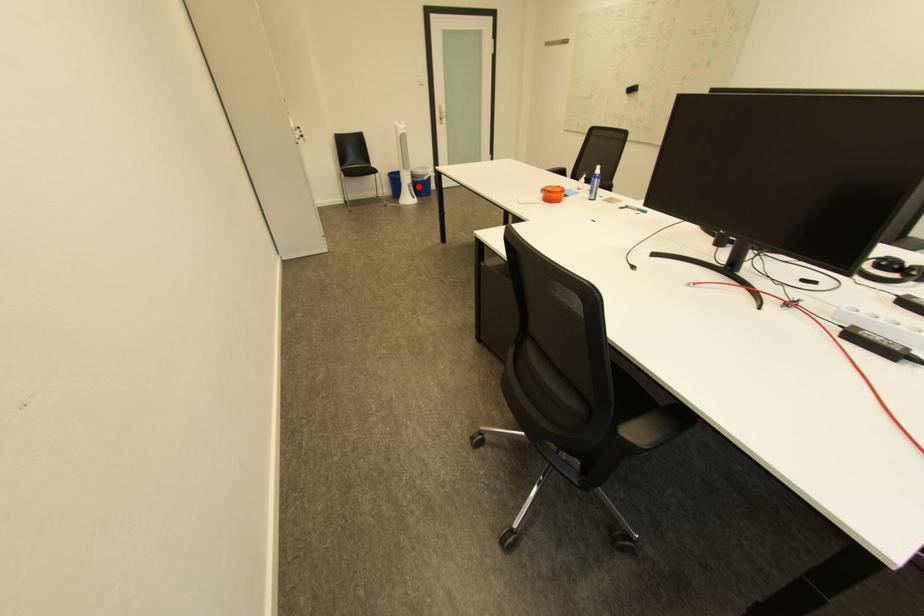
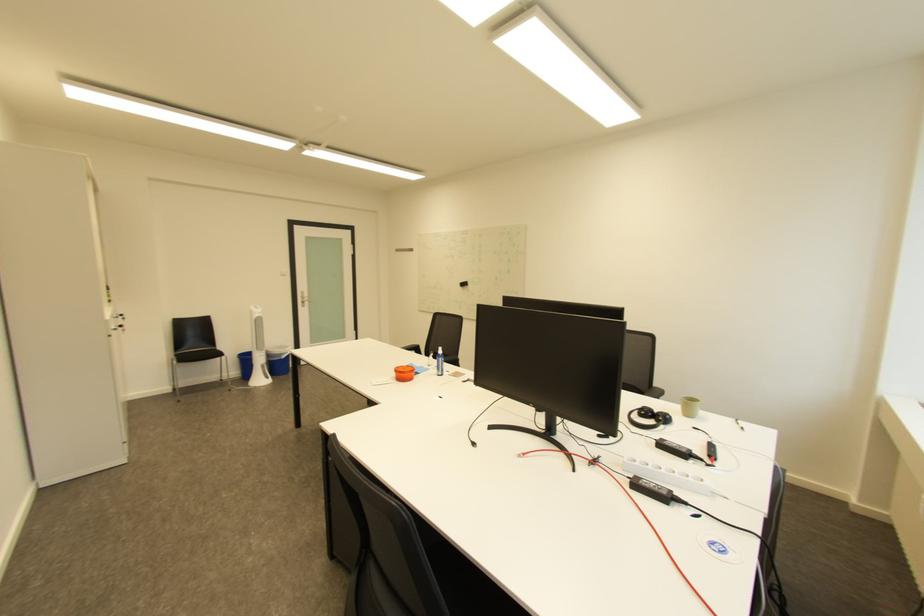
Where in the second image is the point corresponding to the highlighted location from the first image?

(273, 367)